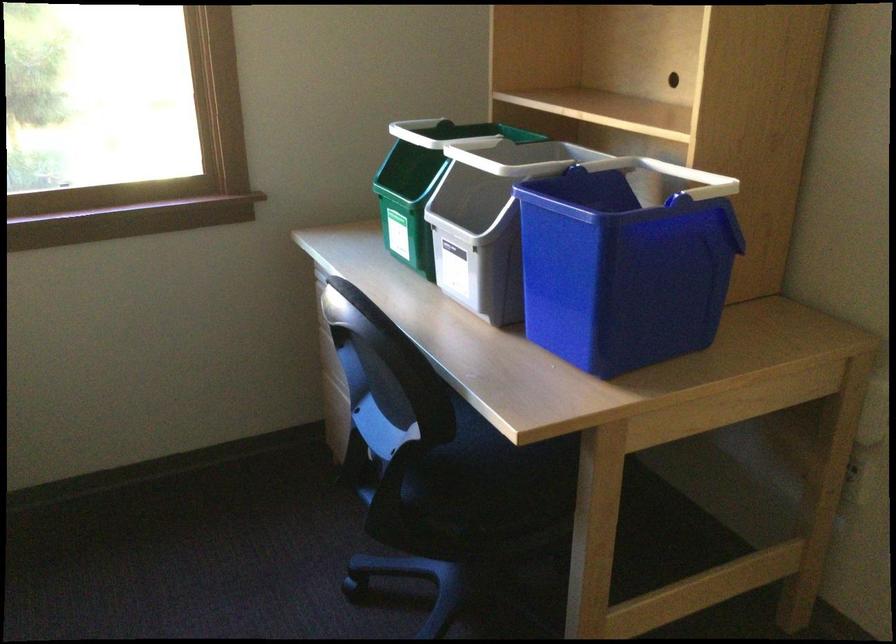
Describe the element at coordinates (479, 201) in the screenshot. The width and height of the screenshot is (896, 644). I see `the white bin handle` at that location.